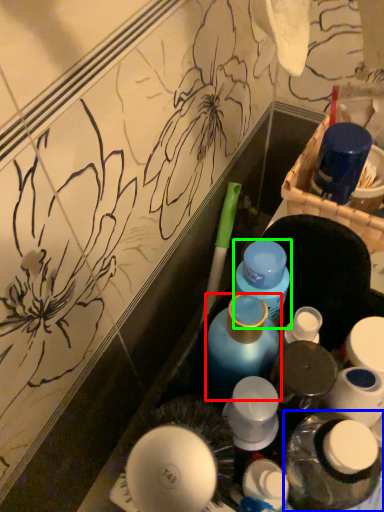
Question: Which object is positioned closest to bottle (highlighted by a red box)? Select from bottle (highlighted by a blue box) and bottle (highlighted by a green box).

Choices:
 (A) bottle
 (B) bottle

Answer: (B)